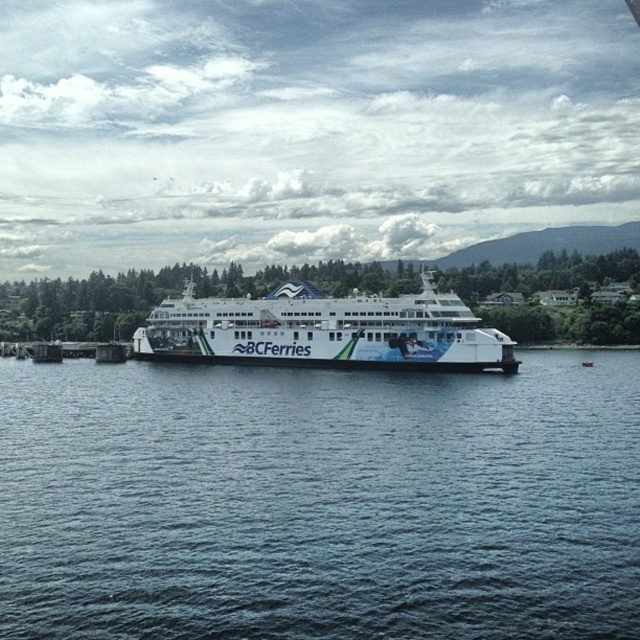
Between blue water at center and white glossy ferry at center, which one appears on the left side from the viewer's perspective?

From the viewer's perspective, white glossy ferry at center appears more on the left side.

Who is lower down, blue water at center or white glossy ferry at center?

blue water at center is lower down.

The image size is (640, 640). In order to click on blue water at center in this screenshot , I will do `click(320, 500)`.

Identify the location of blue water at center. Image resolution: width=640 pixels, height=640 pixels. (320, 500).

Is point (141, 557) positioned after point (124, 346)?

No.

Does blue water at center have a greater height compared to brown wooden dock at lower left?

Correct, blue water at center is much taller as brown wooden dock at lower left.

Which is behind, point (376, 440) or point (40, 360)?

The point (40, 360) is more distant.

Where is `blue water at center`? blue water at center is located at coordinates (320, 500).

Is white glossy ferry at center bigger than brown wooden dock at lower left?

Indeed, white glossy ferry at center has a larger size compared to brown wooden dock at lower left.

Can you confirm if white glossy ferry at center is positioned to the right of brown wooden dock at lower left?

Indeed, white glossy ferry at center is positioned on the right side of brown wooden dock at lower left.

Locate an element on the screen. The image size is (640, 640). white glossy ferry at center is located at coordinates (324, 330).